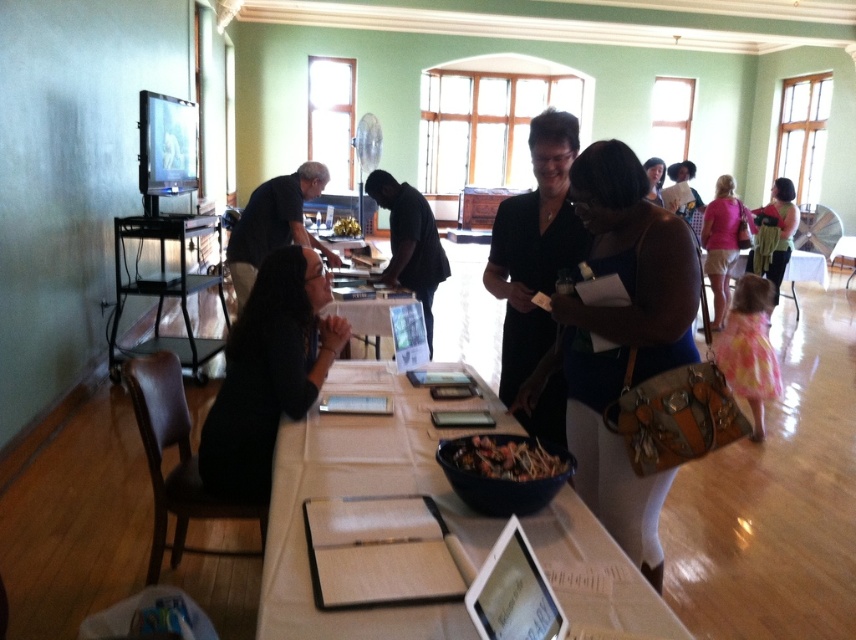
You are standing in the room and want to determine which of the two points, point (581, 595) or point (324, 289), is closer to you. Can you figure out which one is nearer?

Point (581, 595) is closer to the viewer than point (324, 289), so it is the nearer one.

Looking at this image, you are a person with a 12 inch wide backpack. You want to walk between the white paper at center and the black matte dress at center. Can you fit through the space between them?

The distance between the white paper at center and the black matte dress at center is 14.79 inches. Since your backpack is 12 inches wide, you can fit through the space between them as 14.79 inches is wider than 12 inches.

Based on the photo, you are a guest at the event and want to pick up the white paper at center. From your perspective facing the table, which side of the black matte dress at center should you look to find it?

The white paper at center is located to the right of the black matte dress at center, so you should look to the right side of the black matte dress at center to find it.